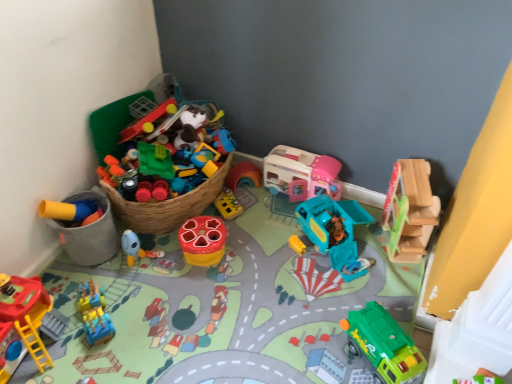
Where is `vacant area that lies between green matte truck at lower right, arranged as the second toy when viewed from the right, and blue plastic train at lower left, placed as the second toy when sorted from left to right`? vacant area that lies between green matte truck at lower right, arranged as the second toy when viewed from the right, and blue plastic train at lower left, placed as the second toy when sorted from left to right is located at coordinates (227, 334).